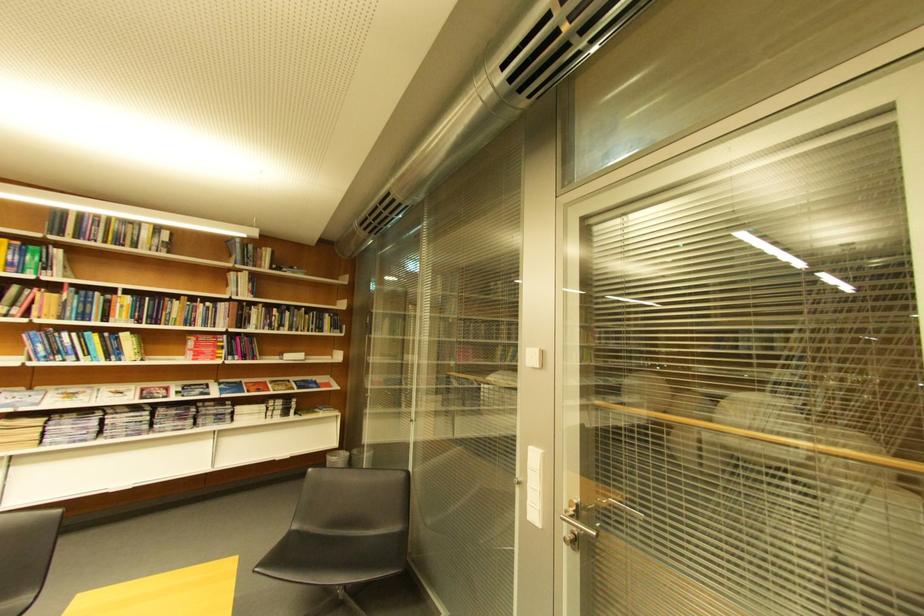
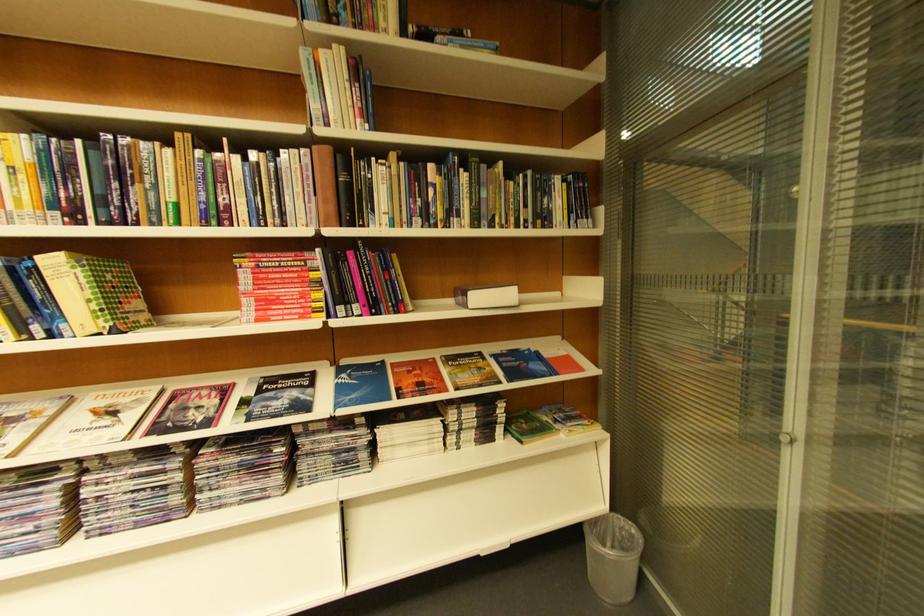
Locate, in the second image, the point that corresponds to (171,389) in the first image.

(224, 389)